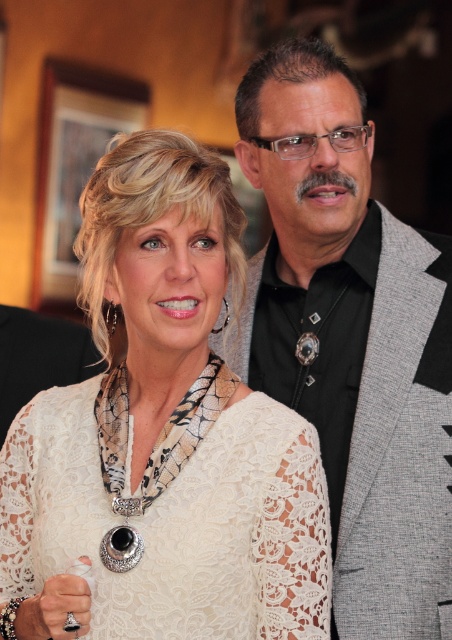
Question: Among these points, which one is nearest to the camera?

Choices:
 (A) (362, 595)
 (B) (207, 596)

Answer: (B)

Question: Is white lace dress at center smaller than gray textured suit at right?

Choices:
 (A) yes
 (B) no

Answer: (B)

Question: Is white lace dress at center to the left of gray textured suit at right from the viewer's perspective?

Choices:
 (A) yes
 (B) no

Answer: (A)

Question: Is white lace dress at center bigger than gray textured suit at right?

Choices:
 (A) no
 (B) yes

Answer: (B)